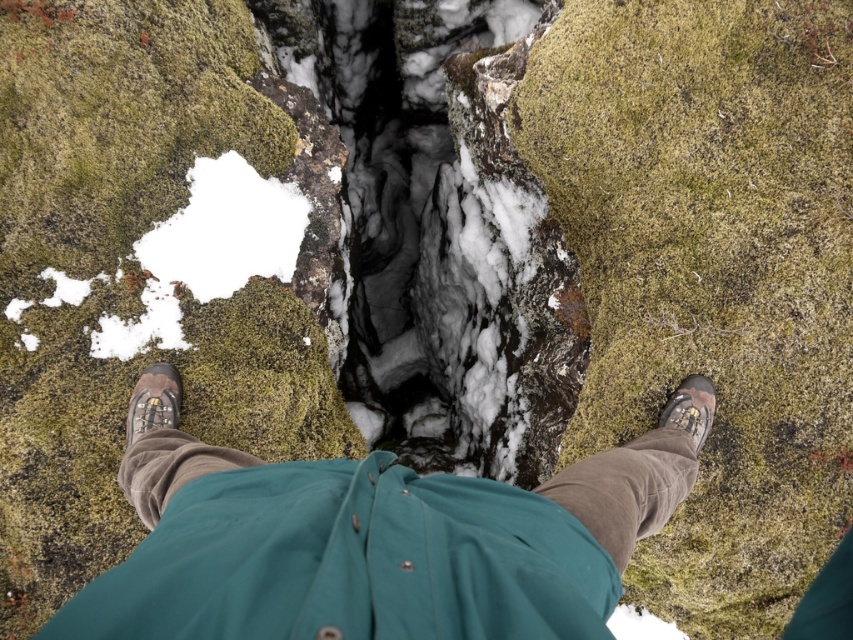
Question: Which object appears farthest from the camera in this image?

Choices:
 (A) brown suede shoe at lower right
 (B) brown suede shoe at lower left

Answer: (A)

Question: Is brown suede shoe at lower left behind brown suede shoe at lower right?

Choices:
 (A) yes
 (B) no

Answer: (B)

Question: Is brown suede boots at center to the right of brown suede shoe at lower left from the viewer's perspective?

Choices:
 (A) no
 (B) yes

Answer: (B)

Question: Is brown suede boots at center to the left of brown suede shoe at lower right from the viewer's perspective?

Choices:
 (A) yes
 (B) no

Answer: (A)

Question: Which point is closer to the camera?

Choices:
 (A) brown suede shoe at lower left
 (B) brown suede shoe at lower right

Answer: (A)

Question: Which point is closer to the camera taking this photo?

Choices:
 (A) (519, 541)
 (B) (708, 380)

Answer: (A)